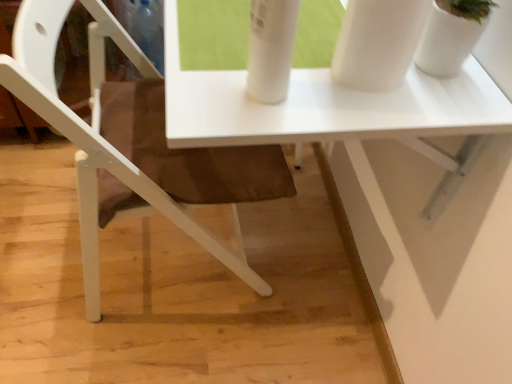
Question: From the image's perspective, is white matte chair at lower left beneath white glossy vase at upper right?

Choices:
 (A) yes
 (B) no

Answer: (A)

Question: Considering the relative sizes of white matte chair at lower left and white glossy vase at upper right in the image provided, is white matte chair at lower left bigger than white glossy vase at upper right?

Choices:
 (A) no
 (B) yes

Answer: (B)

Question: Can we say white matte chair at lower left lies outside white glossy vase at upper right?

Choices:
 (A) no
 (B) yes

Answer: (B)

Question: From a real-world perspective, is white matte chair at lower left located higher than white glossy vase at upper right?

Choices:
 (A) yes
 (B) no

Answer: (B)

Question: Could you tell me if white matte chair at lower left is facing white glossy vase at upper right?

Choices:
 (A) yes
 (B) no

Answer: (A)

Question: Is white matte chair at lower left directly adjacent to white glossy vase at upper right?

Choices:
 (A) no
 (B) yes

Answer: (A)

Question: Does white glossy vase at upper right come behind white glossy table at center?

Choices:
 (A) yes
 (B) no

Answer: (B)

Question: From the image's perspective, is white glossy vase at upper right under white glossy table at center?

Choices:
 (A) yes
 (B) no

Answer: (B)

Question: Is white glossy vase at upper right in front of white glossy table at center?

Choices:
 (A) yes
 (B) no

Answer: (A)

Question: Is white glossy vase at upper right surrounding white glossy table at center?

Choices:
 (A) no
 (B) yes

Answer: (A)

Question: Is white glossy vase at upper right oriented away from white glossy table at center?

Choices:
 (A) no
 (B) yes

Answer: (A)

Question: Does white glossy vase at upper right touch white glossy table at center?

Choices:
 (A) yes
 (B) no

Answer: (B)

Question: Is white glossy table at center not inside white glossy vase at upper right?

Choices:
 (A) yes
 (B) no

Answer: (A)